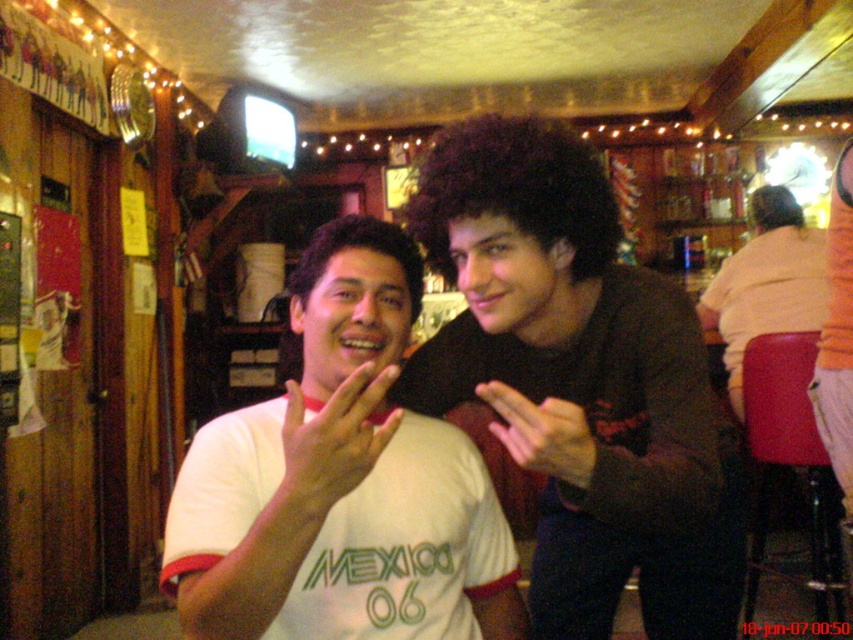
Question: Which point is closer to the camera?

Choices:
 (A) (728, 355)
 (B) (486, 403)
 (C) (343, 428)
 (D) (357, 310)

Answer: (C)

Question: Can you confirm if dark brown hair at center is positioned to the right of pink matte hand at center?

Choices:
 (A) no
 (B) yes

Answer: (B)

Question: Which is nearer to the pink matte hand at center?

Choices:
 (A) white matte hand at center
 (B) white cotton t-shirt at center
 (C) light orange shirt at right
 (D) dark brown hair at center

Answer: (A)

Question: In this image, where is dark brown hair at center located relative to light orange shirt at right?

Choices:
 (A) above
 (B) below

Answer: (B)

Question: Is dark brown hair at center bigger than pink matte hand at center?

Choices:
 (A) yes
 (B) no

Answer: (A)

Question: Which object is farther from the camera taking this photo?

Choices:
 (A) pink matte hand at center
 (B) white cotton t-shirt at center
 (C) white matte hand at center

Answer: (A)